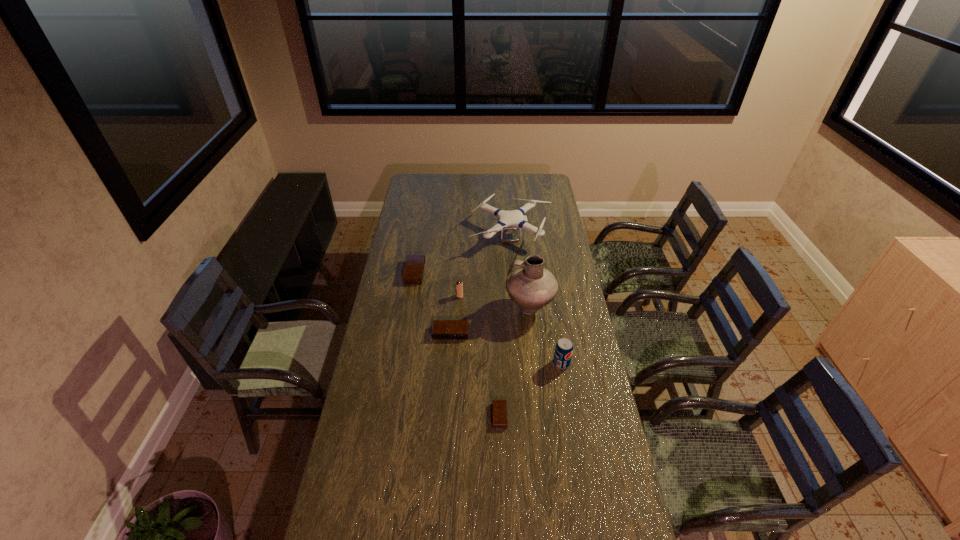
Locate an element on the screen. Image resolution: width=960 pixels, height=540 pixels. vacant space at the near right corner of the desktop is located at coordinates (619, 515).

This screenshot has width=960, height=540. I want to click on unoccupied position between the fourth tallest object and the drone, so click(x=485, y=266).

Where is `vacant space that is in between the drone and the leftmost object`? vacant space that is in between the drone and the leftmost object is located at coordinates (463, 254).

Image resolution: width=960 pixels, height=540 pixels. Identify the location of free space between the pitcher and the second nearest object. (545, 336).

Image resolution: width=960 pixels, height=540 pixels. Find the location of `vacant region between the fourth shortest object and the pop`. vacant region between the fourth shortest object and the pop is located at coordinates (511, 330).

What are the coordinates of `vacant region between the fourth tallest object and the second nearest object` in the screenshot? It's located at (511, 330).

The image size is (960, 540). I want to click on vacant area between the fourth tallest object and the tallest object, so click(x=494, y=302).

Where is `vacant region between the drone and the second nearest alarm clock`? vacant region between the drone and the second nearest alarm clock is located at coordinates (480, 285).

Locate an element on the screen. The image size is (960, 540). unoccupied area between the farthest alarm clock and the fourth tallest object is located at coordinates (437, 285).

I want to click on free space between the sixth farthest object and the tallest object, so click(x=545, y=336).